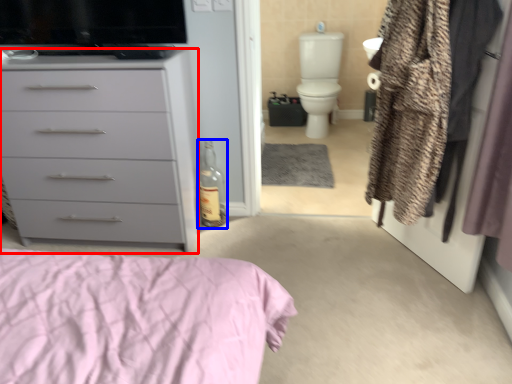
Question: Which object appears closest to the camera in this image, chest of drawers (highlighted by a red box) or bottle (highlighted by a blue box)?

Choices:
 (A) chest of drawers
 (B) bottle

Answer: (A)